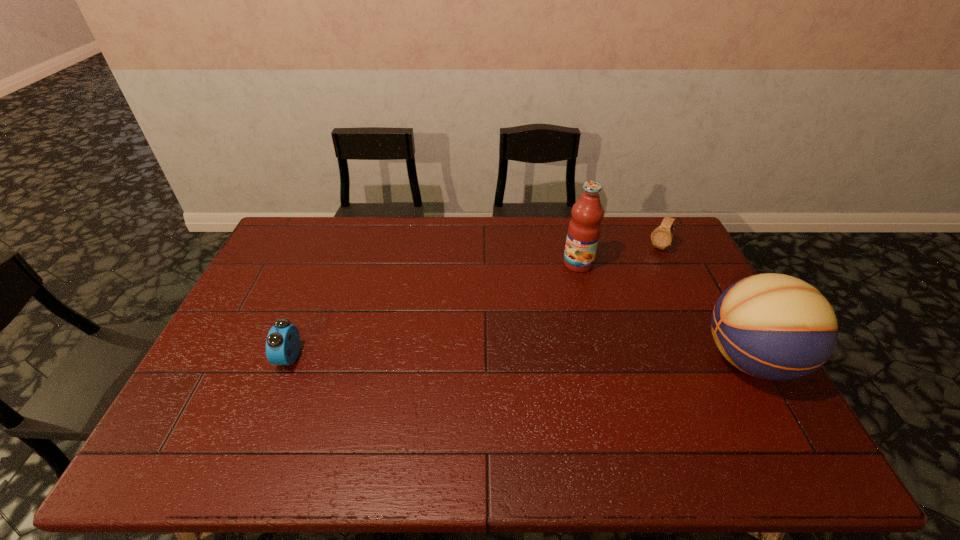
Locate an element on the screen. The width and height of the screenshot is (960, 540). vacant area that lies between the basketball and the fruit juice is located at coordinates (663, 312).

Where is `free area in between the watch and the alarm clock`? free area in between the watch and the alarm clock is located at coordinates coord(474,302).

In order to click on free spot between the leftmost object and the watch in this screenshot , I will do `click(474, 302)`.

At what (x,y) coordinates should I click in order to perform the action: click on blank region between the leftmost object and the second object from left to right. Please return your answer as a coordinate pair (x, y). Looking at the image, I should click on (434, 310).

Locate an element on the screen. free spot between the watch and the leftmost object is located at coordinates (474, 302).

What are the coordinates of `vacant space that's between the basketball and the third object from right to left` in the screenshot? It's located at (663, 312).

Find the location of a particular element. empty space that is in between the leftmost object and the watch is located at coordinates (474, 302).

Identify which object is the third closest to the leftmost object. Please provide its 2D coordinates. Your answer should be formatted as a tuple, i.e. [(x, y)], where the tuple contains the x and y coordinates of a point satisfying the conditions above.

[(661, 237)]

Locate which object ranks second in proximity to the alarm clock. Please provide its 2D coordinates. Your answer should be formatted as a tuple, i.e. [(x, y)], where the tuple contains the x and y coordinates of a point satisfying the conditions above.

[(772, 326)]

Find the location of a particular element. Image resolution: width=960 pixels, height=540 pixels. free space that satisfies the following two spatial constraints: 1. on the front side of the fruit juice; 2. on the patterned surface of the basketball is located at coordinates (602, 359).